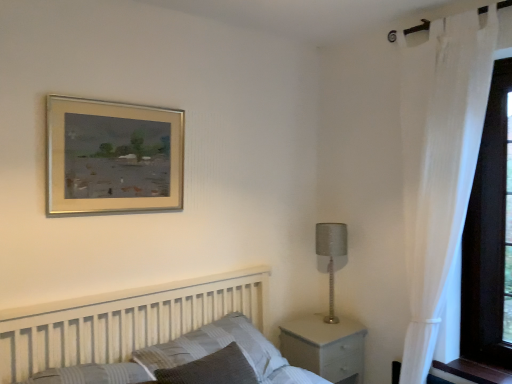
What is the approximate height of striped fabric pillow at center?

striped fabric pillow at center is 23.04 centimeters tall.

What do you see at coordinates (214, 347) in the screenshot?
I see `striped fabric pillow at center` at bounding box center [214, 347].

What is the approximate width of satin silver lamp at right?

satin silver lamp at right is 6.01 inches in width.

This screenshot has width=512, height=384. What do you see at coordinates (325, 346) in the screenshot? I see `white matte nightstand at lower right` at bounding box center [325, 346].

Where is `striped fabric pillow at center`? Image resolution: width=512 pixels, height=384 pixels. striped fabric pillow at center is located at coordinates (214, 347).

Is white sheer curtain at right surrounding white wooden bed at lower left?

No, white wooden bed at lower left is not a part of white sheer curtain at right.

How distant is white sheer curtain at right from white wooden bed at lower left?

white sheer curtain at right and white wooden bed at lower left are 1.26 meters apart.

The image size is (512, 384). Identify the location of bed that is on the left side of white sheer curtain at right. (124, 321).

Does white sheer curtain at right appear on the right side of white wooden bed at lower left?

Yes.

From a real-world perspective, between satin silver lamp at right and gold metallic picture frame at upper center, who is vertically higher?

From a 3D spatial view, gold metallic picture frame at upper center is above.

Is satin silver lamp at right behind gold metallic picture frame at upper center?

Yes, the depth of satin silver lamp at right is greater than that of gold metallic picture frame at upper center.

Is satin silver lamp at right directly adjacent to gold metallic picture frame at upper center?

No, satin silver lamp at right is not next to gold metallic picture frame at upper center.

Considering the sizes of objects white matte nightstand at lower right and white sheer curtain at right in the image provided, who is smaller, white matte nightstand at lower right or white sheer curtain at right?

white matte nightstand at lower right.

Considering the sizes of objects white matte nightstand at lower right and white sheer curtain at right in the image provided, who is shorter, white matte nightstand at lower right or white sheer curtain at right?

white matte nightstand at lower right is shorter.

Would you say white matte nightstand at lower right is a long distance from white sheer curtain at right?

No, white matte nightstand at lower right is not far away from white sheer curtain at right.

Considering the sizes of objects white matte nightstand at lower right and white wooden bed at lower left in the image provided, who is taller, white matte nightstand at lower right or white wooden bed at lower left?

With more height is white wooden bed at lower left.

Between white matte nightstand at lower right and white wooden bed at lower left, which one appears on the right side from the viewer's perspective?

white matte nightstand at lower right is more to the right.

Is the surface of white matte nightstand at lower right in direct contact with white wooden bed at lower left?

No.

Based on the photo, could you tell me if white matte nightstand at lower right is facing white wooden bed at lower left?

No, white matte nightstand at lower right does not turn towards white wooden bed at lower left.

From the image's perspective, is white sheer curtain at right positioned above or below satin silver lamp at right?

Based on their image positions, white sheer curtain at right is located above satin silver lamp at right.

Does white sheer curtain at right touch satin silver lamp at right?

white sheer curtain at right is not next to satin silver lamp at right, and they're not touching.

Considering the relative positions of white sheer curtain at right and satin silver lamp at right in the image provided, is white sheer curtain at right to the left of satin silver lamp at right from the viewer's perspective?

Incorrect, white sheer curtain at right is not on the left side of satin silver lamp at right.

Is point (445, 234) closer or farther from the camera than point (333, 238)?

Point (445, 234) is positioned closer to the camera compared to point (333, 238).

Does white wooden bed at lower left have a lesser height compared to satin silver lamp at right?

Yes.

Is satin silver lamp at right inside white wooden bed at lower left?

Actually, satin silver lamp at right is outside white wooden bed at lower left.

Is white wooden bed at lower left at the right side of satin silver lamp at right?

In fact, white wooden bed at lower left is to the left of satin silver lamp at right.

You are a GUI agent. You are given a task and a screenshot of the screen. Output one action in this format:
    pyautogui.click(x=<x>, y=<y>)
    Task: Click on the bed lying in front of the satin silver lamp at right
    
    Given the screenshot: What is the action you would take?
    pos(124,321)

Between striped fabric pillow at center and white matte nightstand at lower right, which one has smaller width?

With smaller width is striped fabric pillow at center.

Consider the image. Is striped fabric pillow at center not inside white matte nightstand at lower right?

That's correct, striped fabric pillow at center is outside of white matte nightstand at lower right.

Is striped fabric pillow at center facing towards white matte nightstand at lower right?

No, striped fabric pillow at center is not oriented towards white matte nightstand at lower right.

In order to click on curtain above the white wooden bed at lower left (from a real-world perspective) in this screenshot , I will do `click(439, 163)`.

Find the location of a particular element. picture frame lying on the left of satin silver lamp at right is located at coordinates (113, 157).

Looking at the image, which one is located further to satin silver lamp at right, gold metallic picture frame at upper center or white matte nightstand at lower right?

Based on the image, gold metallic picture frame at upper center appears to be further to satin silver lamp at right.

Considering their positions, is white sheer curtain at right positioned closer to satin silver lamp at right than striped fabric pillow at center?

white sheer curtain at right is positioned closer to the anchor satin silver lamp at right.

Consider the image. Based on their spatial positions, is striped fabric pillow at center or gold metallic picture frame at upper center closer to white sheer curtain at right?

Among the two, striped fabric pillow at center is located nearer to white sheer curtain at right.

Which object lies further to the anchor point satin silver lamp at right, white matte nightstand at lower right or white sheer curtain at right?

Based on the image, white sheer curtain at right appears to be further to satin silver lamp at right.

Based on their spatial positions, is white sheer curtain at right or satin silver lamp at right further from white matte nightstand at lower right?

The object further to white matte nightstand at lower right is white sheer curtain at right.

Considering their positions, is white matte nightstand at lower right positioned closer to gold metallic picture frame at upper center than satin silver lamp at right?

satin silver lamp at right lies closer to gold metallic picture frame at upper center than the other object.

Based on their spatial positions, is gold metallic picture frame at upper center or white sheer curtain at right closer to white matte nightstand at lower right?

Based on the image, white sheer curtain at right appears to be nearer to white matte nightstand at lower right.

Which object lies further to the anchor point satin silver lamp at right, white wooden bed at lower left or white sheer curtain at right?

white wooden bed at lower left lies further to satin silver lamp at right than the other object.

The width and height of the screenshot is (512, 384). Identify the location of nightstand situated between gold metallic picture frame at upper center and white sheer curtain at right from left to right. (325, 346).

This screenshot has height=384, width=512. Identify the location of curtain located between white wooden bed at lower left and satin silver lamp at right in the depth direction. (439, 163).

Where is `pillow located between white wooden bed at lower left and satin silver lamp at right in the depth direction`? The height and width of the screenshot is (384, 512). pillow located between white wooden bed at lower left and satin silver lamp at right in the depth direction is located at coordinates (214, 347).

Identify the location of curtain between white wooden bed at lower left and white matte nightstand at lower right in the front-back direction. (439, 163).